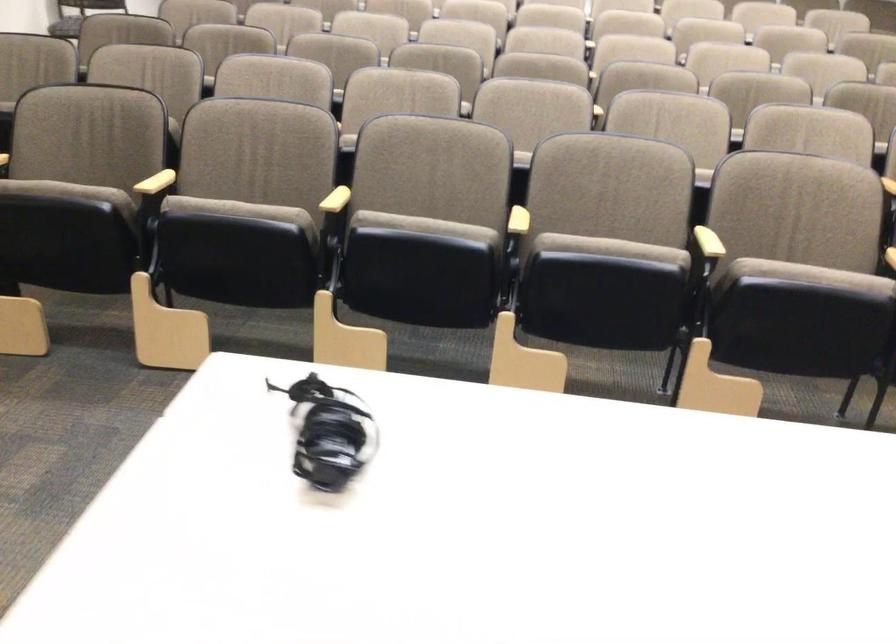
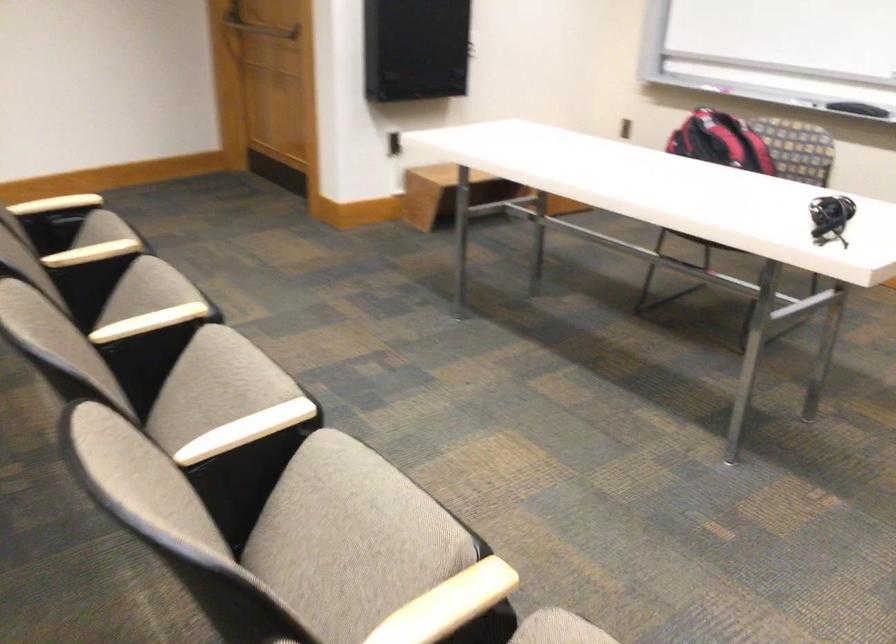
In the second image, find the point that corresponds to the point at 414,230 in the first image.

(352, 531)